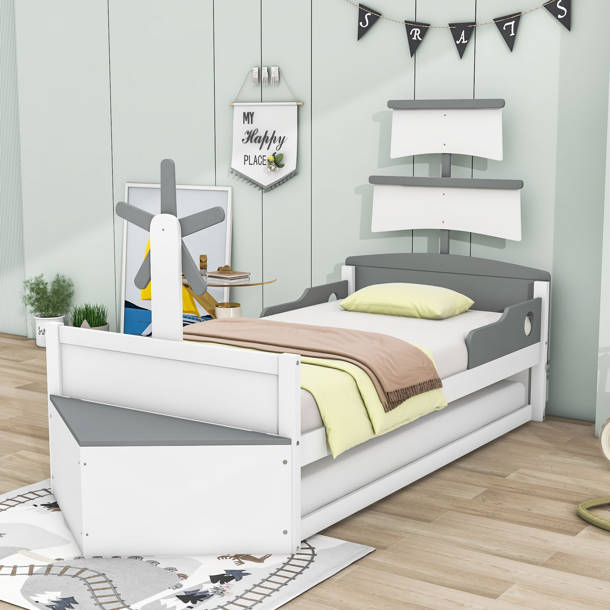
In order to click on floor in this screenshot , I will do `click(518, 511)`.